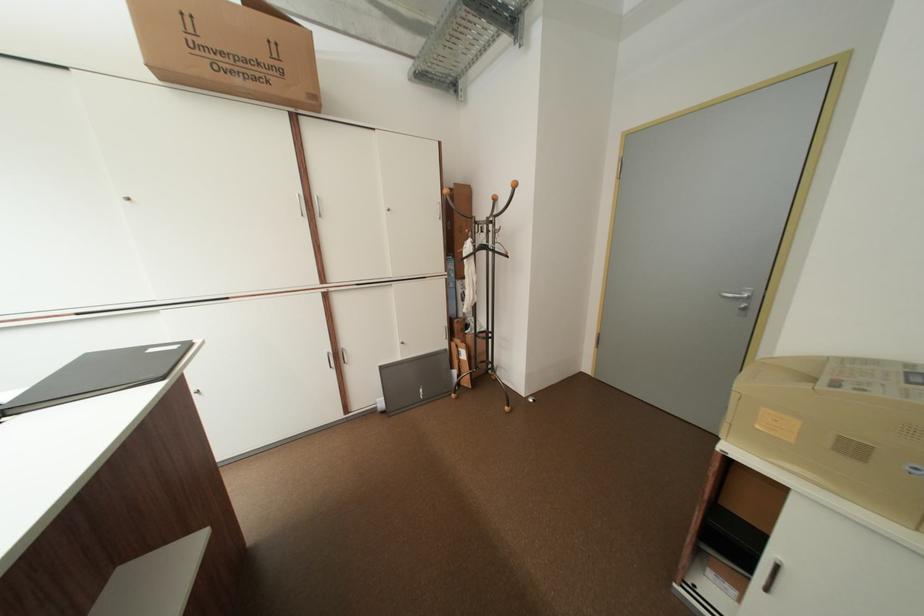
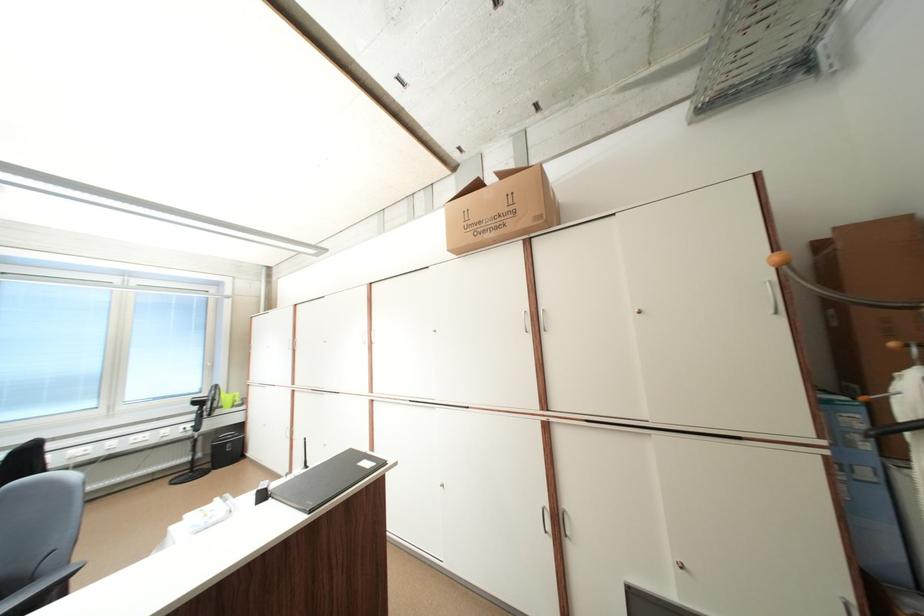
Question: How did the camera likely rotate?

Choices:
 (A) Left
 (B) Right
 (C) Up
 (D) Down

Answer: (A)